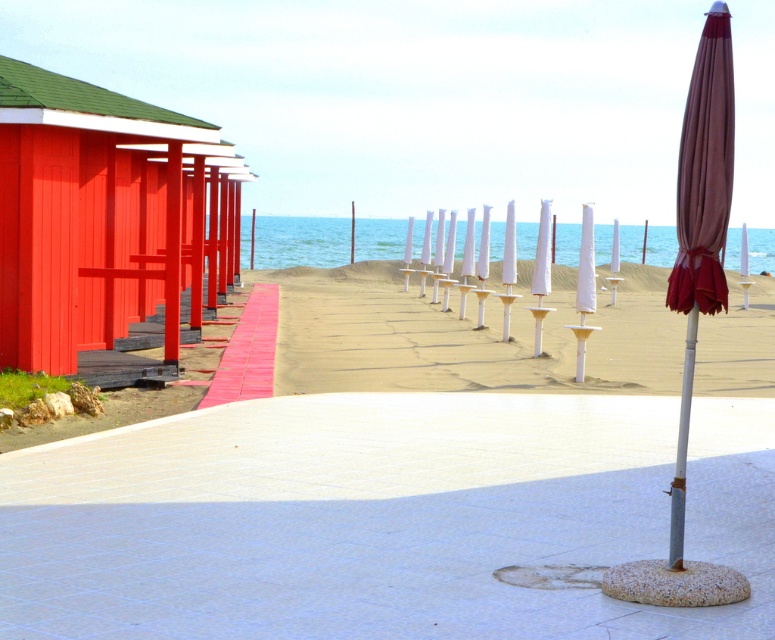
You are standing at the origin point in the beach scene. There are two points marked on the sand. The first point is at coordinates point (291, 372) and the second is at point (236, 384). If you want to walk towards the point that is further away from you, which coordinate should you head toward?

You should head toward point (291, 372) because it is behind point (236, 384), meaning it is farther away from your current position at the origin.

You are planning to build a small sandcastle on the beach. You have two options for the base material. The first option is the beige sand at center, and the second option is the red brick walkway at left. Which material would you choose for a more stable base, and why?

The beige sand at center is bigger than the red brick walkway at left. Therefore, the beige sand at center would provide a more stable base for the sandcastle because larger particles of sand offer better structural support and are less likely to shift compared to smaller particles found on the walkway.